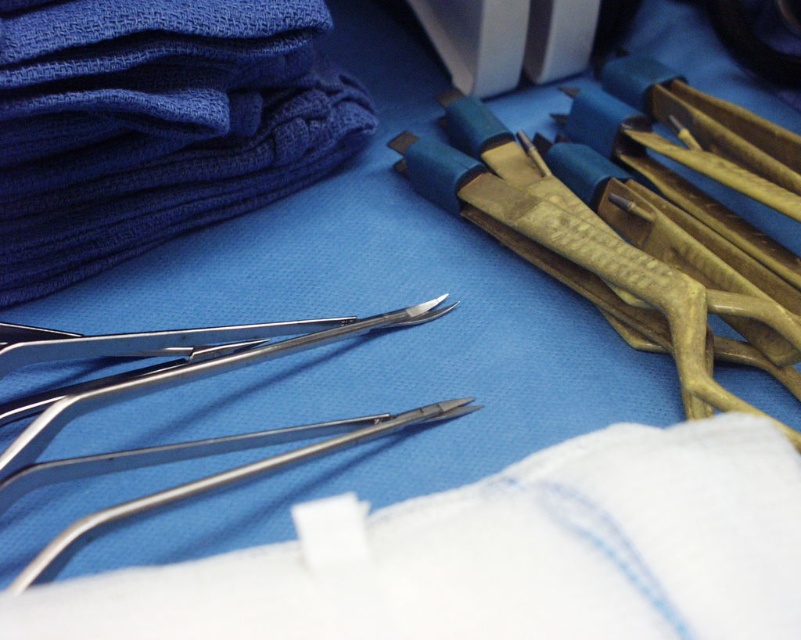
Which is in front, point (791, 584) or point (429, 404)?

Point (791, 584)

Is point (492, 561) less distant than point (49, 566)?

Yes.

This screenshot has height=640, width=801. Describe the element at coordinates (496, 556) in the screenshot. I see `white fabric at center` at that location.

This screenshot has height=640, width=801. Find the location of `white fabric at center`. white fabric at center is located at coordinates (496, 556).

Is point (304, 561) closer to viewer compared to point (749, 344)?

Yes, point (304, 561) is closer to viewer.

Is point (747, 515) closer to viewer compared to point (657, 218)?

Yes.

What are the coordinates of `white fabric at center` in the screenshot? It's located at (496, 556).

Can you confirm if blue fabric at upper left is thinner than polished metal forceps at center?

Incorrect, blue fabric at upper left's width is not less than polished metal forceps at center's.

Does blue fabric at upper left appear under polished metal forceps at center?

Actually, blue fabric at upper left is above polished metal forceps at center.

Where is `blue fabric at upper left`? The image size is (801, 640). blue fabric at upper left is located at coordinates (155, 124).

I want to click on blue fabric at upper left, so pos(155,124).